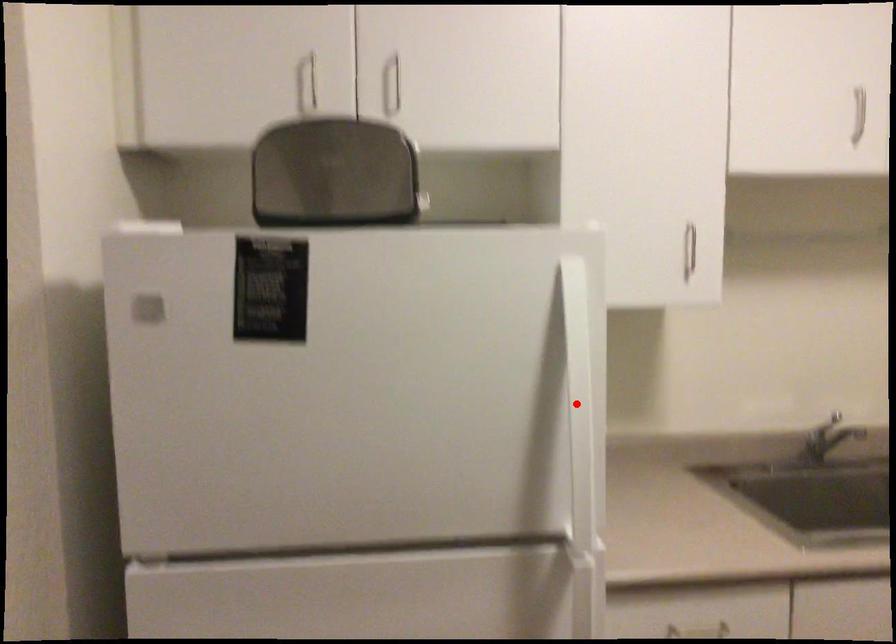
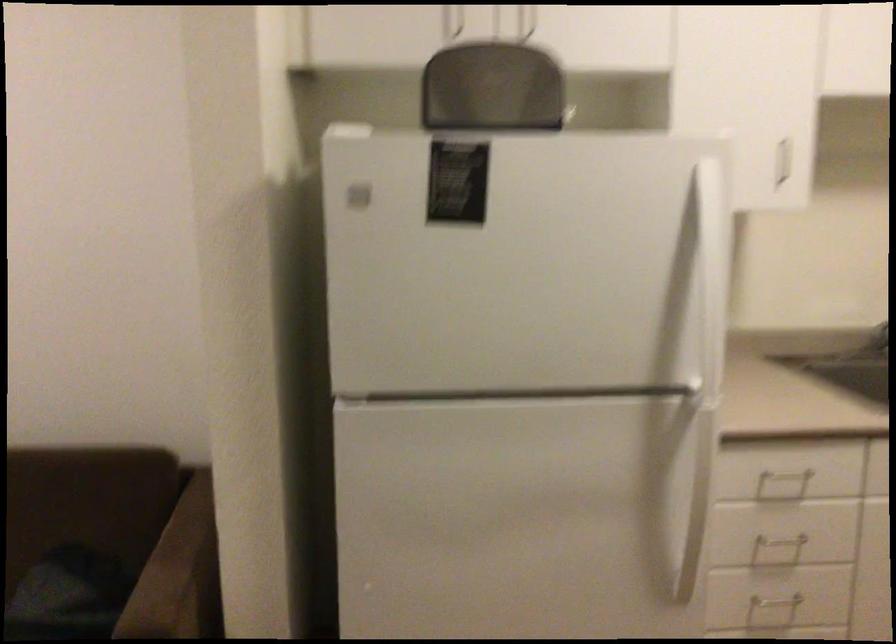
Question: I am providing you with two images of the same scene from different viewpoints. Given a red point in image1, look at the same physical point in image2. Is it:

Choices:
 (A) Closer to the viewpoint
 (B) Farther from the viewpoint

Answer: (B)